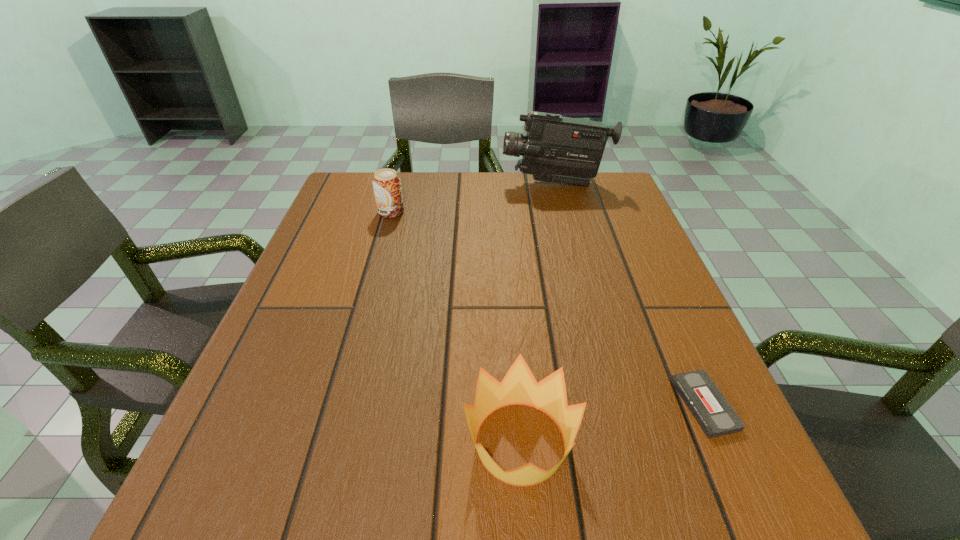
The width and height of the screenshot is (960, 540). I want to click on vacant point located 0.210m on the back of the crown, so click(x=510, y=304).

You are a GUI agent. You are given a task and a screenshot of the screen. Output one action in this format:
    pyautogui.click(x=<x>, y=<y>)
    Task: Click on the free spot located on the left of the shortest object
    
    Given the screenshot: What is the action you would take?
    pyautogui.click(x=629, y=404)

This screenshot has width=960, height=540. I want to click on camcorder that is positioned at the far edge, so click(x=559, y=149).

Find the location of `beer can that is positioned at the far edge`. beer can that is positioned at the far edge is located at coordinates (386, 183).

Where is `object located at the near edge`? This screenshot has width=960, height=540. object located at the near edge is located at coordinates (519, 386).

Locate an element on the screen. This screenshot has height=540, width=960. object located in the left edge section of the desktop is located at coordinates (386, 183).

The image size is (960, 540). Identify the location of camcorder present at the right edge. [x=559, y=149].

Where is `videotape present at the right edge`? The width and height of the screenshot is (960, 540). videotape present at the right edge is located at coordinates (713, 413).

At what (x,y) coordinates should I click in order to perform the action: click on object that is at the far left corner. Please return your answer as a coordinate pair (x, y). This screenshot has height=540, width=960. Looking at the image, I should click on (386, 183).

Locate an element on the screen. This screenshot has width=960, height=540. object at the far right corner is located at coordinates (559, 149).